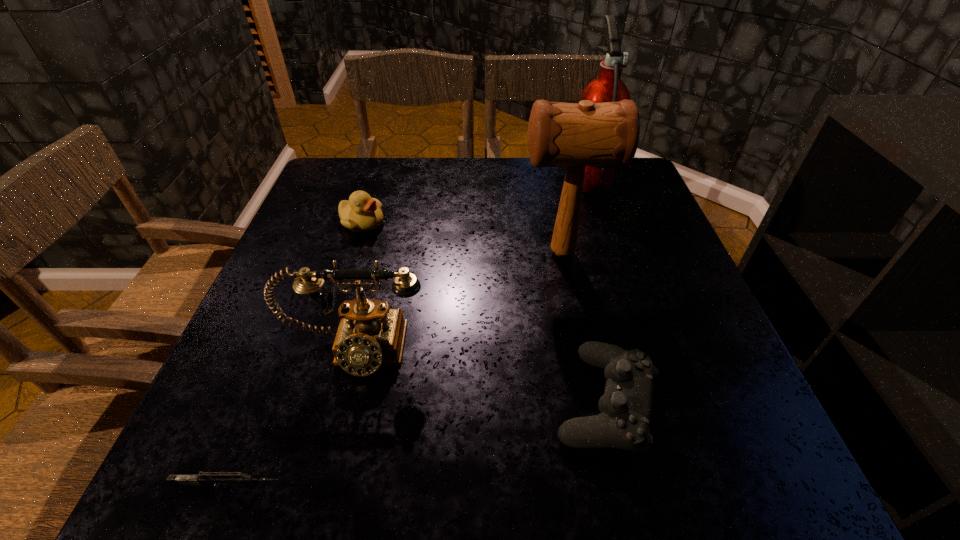
Find the location of `vacant space situated 0.240m on the strike surface of the mallet`. vacant space situated 0.240m on the strike surface of the mallet is located at coordinates (414, 253).

This screenshot has height=540, width=960. I want to click on free space located 0.160m on the strike surface of the mallet, so click(x=449, y=253).

This screenshot has height=540, width=960. I want to click on free spot located 0.240m on the strike surface of the mallet, so click(x=414, y=253).

The width and height of the screenshot is (960, 540). In order to click on free location located 0.080m on the dial number of the telephone in this screenshot , I will do `click(334, 424)`.

Find the location of a particular element. Image resolution: width=960 pixels, height=540 pixels. vacant space located on the beak of the duckling is located at coordinates (502, 223).

Where is `vacant space located 0.240m on the left of the fifth tallest object`? vacant space located 0.240m on the left of the fifth tallest object is located at coordinates (408, 401).

This screenshot has height=540, width=960. What are the coordinates of `free space located 0.220m aimed along the barrel of the gun` in the screenshot? It's located at (436, 487).

The width and height of the screenshot is (960, 540). What are the coordinates of `object that is at the far edge` in the screenshot? It's located at (608, 87).

You are a GUI agent. You are given a task and a screenshot of the screen. Output one action in this format:
    pyautogui.click(x=<x>, y=<y>)
    Task: Click on the control that is positioned at the near edge
    This screenshot has width=960, height=540.
    Given the screenshot: What is the action you would take?
    pyautogui.click(x=625, y=408)

You are a GUI agent. You are given a task and a screenshot of the screen. Output one action in this format:
    pyautogui.click(x=<x>, y=<y>)
    Task: Click on the gun located at the near edge
    The width and height of the screenshot is (960, 540).
    Given the screenshot: What is the action you would take?
    pyautogui.click(x=218, y=478)